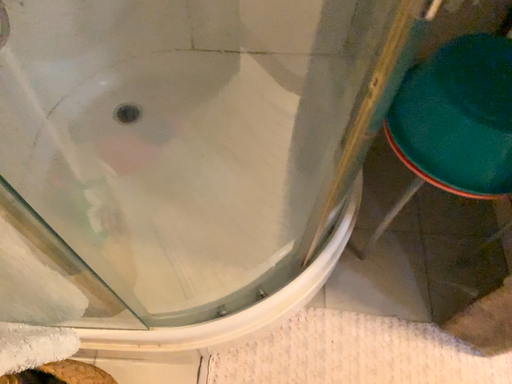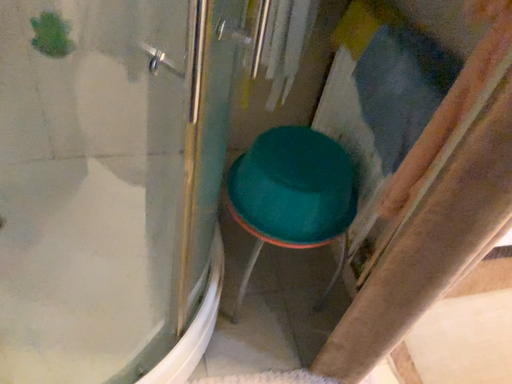
Question: Which way did the camera rotate in the video?

Choices:
 (A) rotated right
 (B) rotated left

Answer: (A)